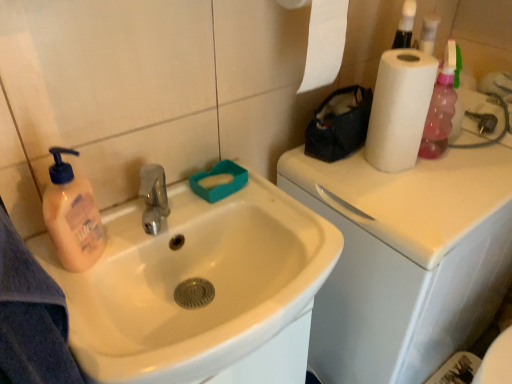
Describe the element at coordinates (399, 109) in the screenshot. Image resolution: width=512 pixels, height=384 pixels. I see `white matte paper towel at upper right` at that location.

Where is `white glossy counter top at upper right`? Image resolution: width=512 pixels, height=384 pixels. white glossy counter top at upper right is located at coordinates (406, 259).

What is the approximate width of white glossy counter top at upper right?

25.08 inches.

Identify the location of white matte paper towel at upper right. This screenshot has width=512, height=384. click(x=399, y=109).

Could you tell me if white matte paper towel at upper right is facing white glossy sink at left?

No, white matte paper towel at upper right is not turned towards white glossy sink at left.

Does white matte paper towel at upper right lie behind white glossy sink at left?

That is True.

Is white matte paper towel at upper right to the left or to the right of white glossy sink at left in the image?

Based on their positions, white matte paper towel at upper right is located to the right of white glossy sink at left.

From the image's perspective, is white matte paper towel at upper right located above or below white glossy sink at left?

white matte paper towel at upper right is above white glossy sink at left.

Which object is positioned more to the left, white glossy counter top at upper right or white glossy sink at left?

white glossy sink at left.

You are a GUI agent. You are given a task and a screenshot of the screen. Output one action in this format:
    pyautogui.click(x=<x>, y=<y>)
    Task: Click on the counter top to the right of white glossy sink at left
    
    Given the screenshot: What is the action you would take?
    pyautogui.click(x=406, y=259)

Which of these two, white glossy counter top at upper right or white glossy sink at left, is bigger?

white glossy counter top at upper right is bigger.

Which object is closer to the camera, white glossy counter top at upper right or white glossy sink at left?

white glossy sink at left is in front.

Considering the sizes of white glossy counter top at upper right and white matte paper towel at upper right in the image, is white glossy counter top at upper right wider or thinner than white matte paper towel at upper right?

white glossy counter top at upper right is wider than white matte paper towel at upper right.

From the image's perspective, who appears lower, white glossy counter top at upper right or white matte paper towel at upper right?

white glossy counter top at upper right.

Is white glossy counter top at upper right inside the boundaries of white matte paper towel at upper right, or outside?

white glossy counter top at upper right is spatially situated outside white matte paper towel at upper right.

Is the surface of white glossy counter top at upper right in direct contact with white matte paper towel at upper right?

There is a gap between white glossy counter top at upper right and white matte paper towel at upper right.

In terms of size, does white glossy sink at left appear bigger or smaller than white matte paper towel at upper right?

Considering their sizes, white glossy sink at left takes up more space than white matte paper towel at upper right.

Is white glossy sink at left not within white matte paper towel at upper right?

white glossy sink at left is positioned outside white matte paper towel at upper right.

Is white glossy sink at left aimed at white matte paper towel at upper right?

No, white glossy sink at left is not facing towards white matte paper towel at upper right.

How distant is white glossy sink at left from white matte paper towel at upper right?

white glossy sink at left is 15.92 inches from white matte paper towel at upper right.

Is white matte paper towel at upper right to the left or to the right of white glossy counter top at upper right in the image?

white matte paper towel at upper right is positioned on white glossy counter top at upper right's left side.

From a real-world perspective, is white matte paper towel at upper right positioned over white glossy counter top at upper right based on gravity?

Yes, from a real-world perspective, white matte paper towel at upper right is over white glossy counter top at upper right

From the image's perspective, is white matte paper towel at upper right above white glossy counter top at upper right?

Indeed, from the image's perspective, white matte paper towel at upper right is shown above white glossy counter top at upper right.

Can you confirm if white matte paper towel at upper right is bigger than white glossy counter top at upper right?

Incorrect, white matte paper towel at upper right is not larger than white glossy counter top at upper right.

Consider the image. Between white glossy sink at left and white glossy counter top at upper right, which one has less height?

white glossy sink at left is shorter.

Is white glossy sink at left surrounding white glossy counter top at upper right?

No, white glossy counter top at upper right is not a part of white glossy sink at left.

Are white glossy sink at left and white glossy counter top at upper right located far from each other?

white glossy sink at left is near white glossy counter top at upper right, not far away.

Where is `paper towel located on the right of white glossy sink at left`? Image resolution: width=512 pixels, height=384 pixels. paper towel located on the right of white glossy sink at left is located at coordinates (399, 109).

Find the location of a particular element. Image resolution: width=512 pixels, height=384 pixels. sink located on the left of white glossy counter top at upper right is located at coordinates (208, 280).

When comparing their distances from white matte paper towel at upper right, does white glossy sink at left or white glossy counter top at upper right seem closer?

white glossy counter top at upper right lies closer to white matte paper towel at upper right than the other object.

Looking at the image, which one is located closer to white glossy counter top at upper right, white glossy sink at left or white matte paper towel at upper right?

Based on the image, white matte paper towel at upper right appears to be nearer to white glossy counter top at upper right.

Which object lies further to the anchor point white glossy sink at left, white glossy counter top at upper right or white matte paper towel at upper right?

Among the two, white matte paper towel at upper right is located further to white glossy sink at left.

Estimate the real-world distances between objects in this image. Which object is closer to white glossy counter top at upper right, white matte paper towel at upper right or white glossy sink at left?

Based on the image, white matte paper towel at upper right appears to be nearer to white glossy counter top at upper right.

Based on the photo, from the image, which object appears to be nearer to white matte paper towel at upper right, white glossy counter top at upper right or white glossy sink at left?

white glossy counter top at upper right is positioned closer to the anchor white matte paper towel at upper right.

Estimate the real-world distances between objects in this image. Which object is closer to white glossy sink at left, white matte paper towel at upper right or white glossy counter top at upper right?

Based on the image, white glossy counter top at upper right appears to be nearer to white glossy sink at left.

Where is `counter top between white matte paper towel at upper right and white glossy sink at left in the vertical direction`? counter top between white matte paper towel at upper right and white glossy sink at left in the vertical direction is located at coordinates (406, 259).